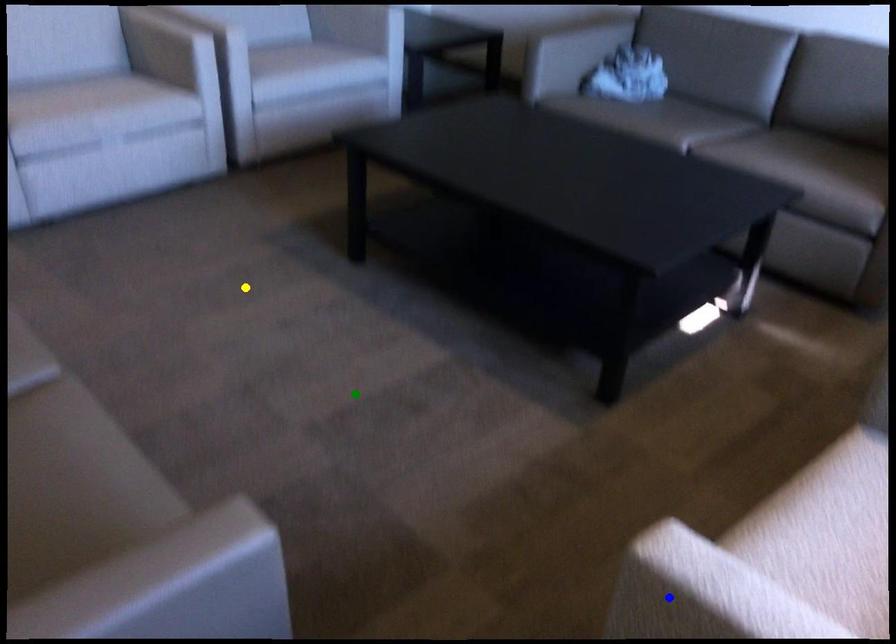
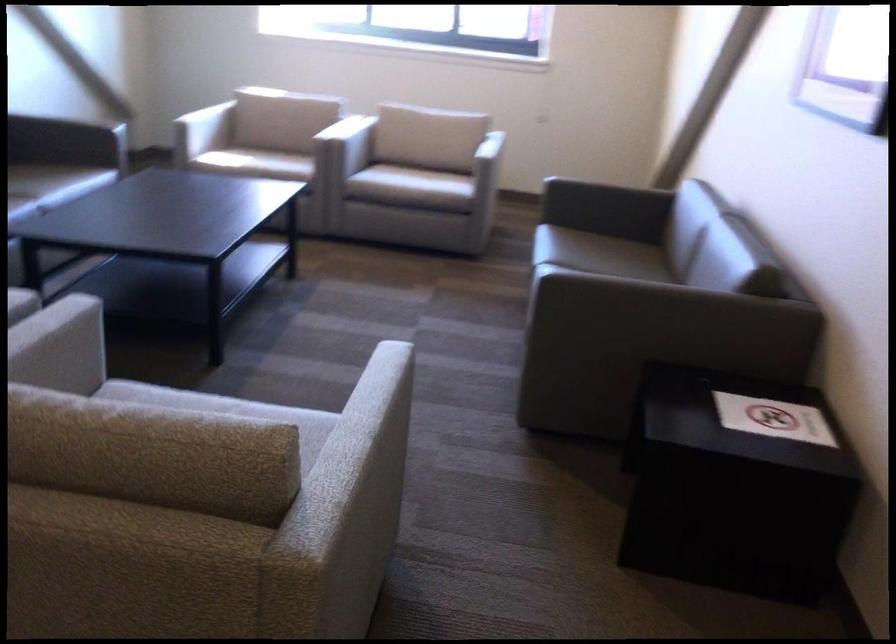
I am providing you with two images of the same scene from different viewpoints. Three points are marked in image1. Which point corresponds to a part or object that is occluded in image2?In image1, three points are marked. Which of them correspond to a part or object that is occluded in image2?Among the three points shown in image1, which one corresponds to a part or object that is no longer visible due to occlusion in image2?

blue point cannot be seen in image2.